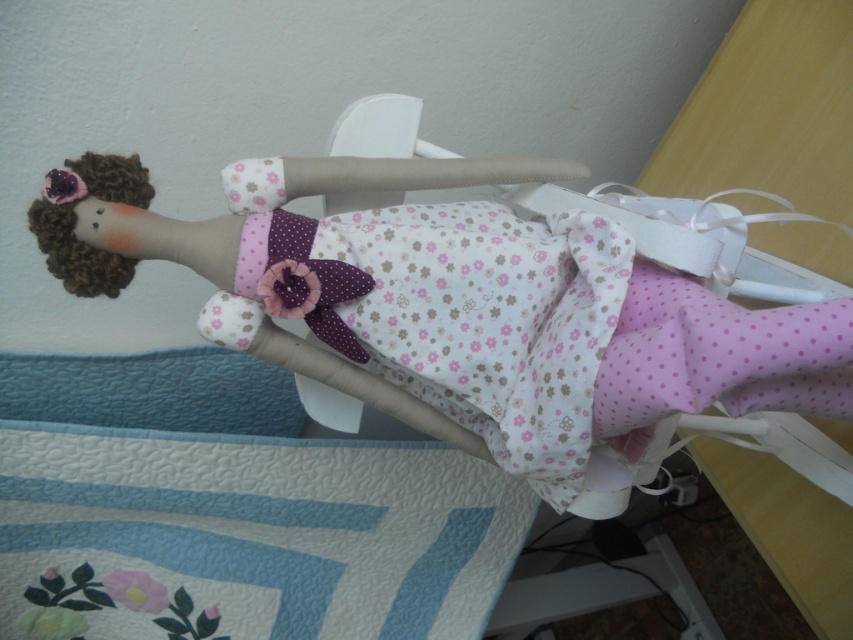
Does fluffy fabric doll at center lie in front of blue quilted fabric at lower left?

Yes, it is in front of blue quilted fabric at lower left.

This screenshot has height=640, width=853. Describe the element at coordinates (469, 305) in the screenshot. I see `fluffy fabric doll at center` at that location.

Which is behind, point (357, 186) or point (219, 545)?

The point (219, 545) is behind.

The width and height of the screenshot is (853, 640). Find the location of `fluffy fabric doll at center`. fluffy fabric doll at center is located at coordinates (469, 305).